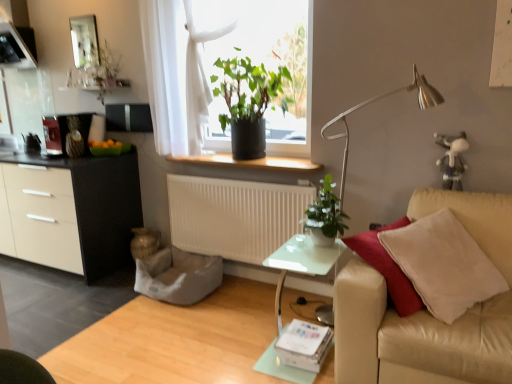
Identify the location of vacant region in front of gray fabric swivel chair at lower center. The width and height of the screenshot is (512, 384). (167, 325).